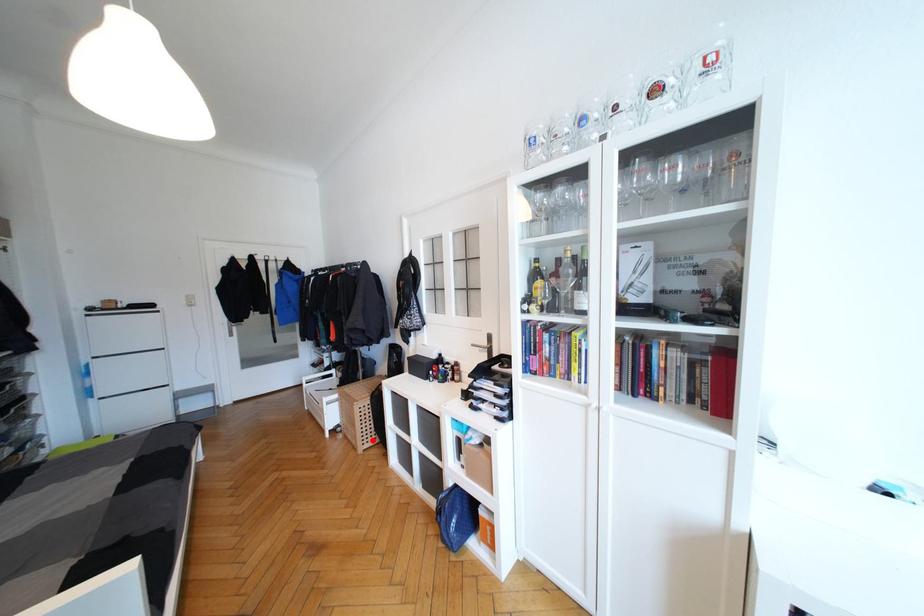
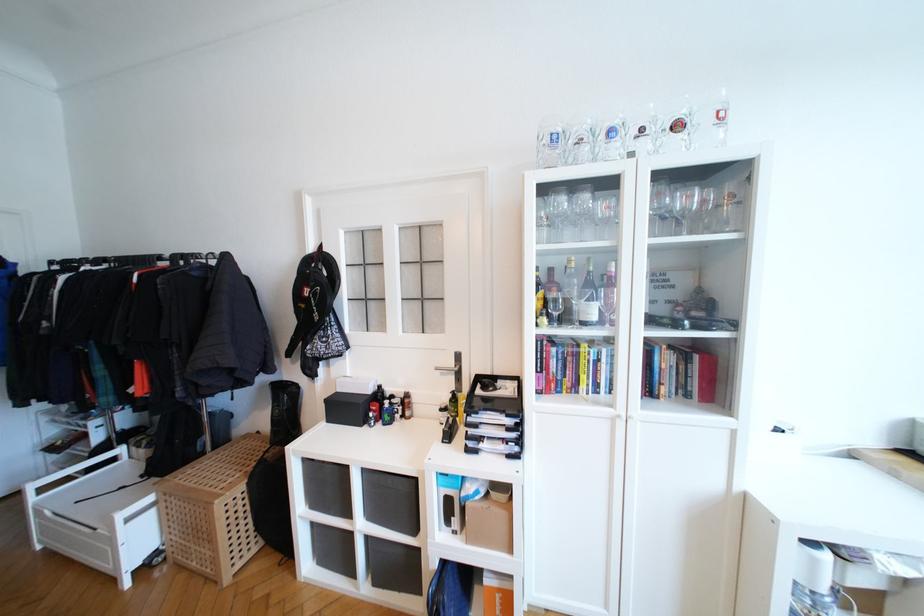
Question: I am providing you with two images of the same scene from different viewpoints. Given a red point in image1, look at the same physical point in image2. Is it:

Choices:
 (A) Closer to the viewpoint
 (B) Farther from the viewpoint

Answer: (A)